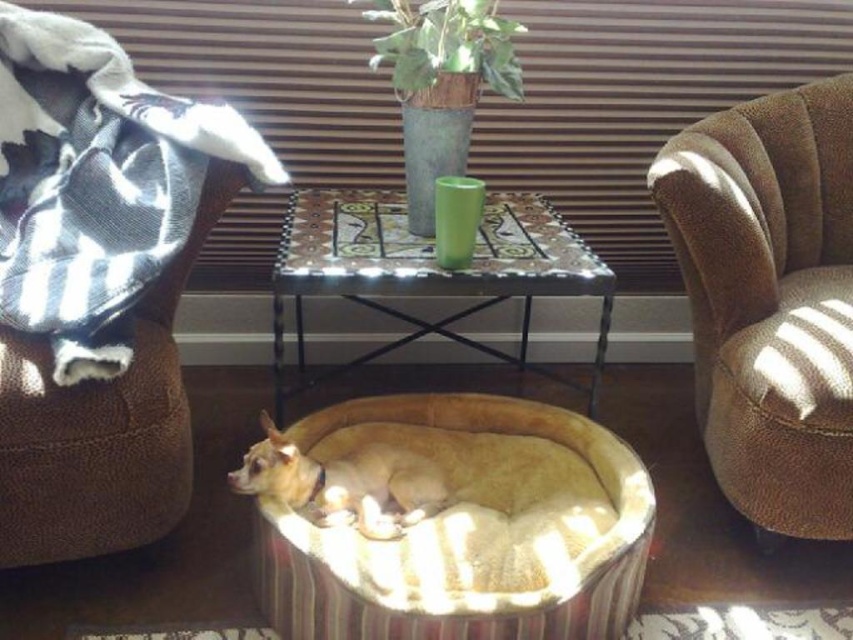
You are a dog owner who wants to ensure your Chihuahua has enough space to move comfortably in the velvet beige dog bed at center. The dog is currently looking towards the black and white striped fabric at upper left. Can you tell me if the dog bed is placed under the striped fabric?

The velvet beige dog bed at center is positioned under the black and white striped fabric at upper left, so yes, the dog bed is placed under the striped fabric.

You are a small cat trying to jump onto the brown textured armchair at right. The fuzzy beige dog at center is in your way. Can you go around the dog to reach the chair?

The brown textured armchair at right is taller than the fuzzy beige dog at center, so you can jump over the dog to reach the chair.

You are standing in the room and want to place a new decorative item on the floor. The velvet beige dog bed at center is already occupying a spot marked by point (451, 522). If you want to place the new item 0.3 units to the left of the dog bed, what coordinate would that be?

The new coordinate would be 0.817 minus 0.3 equals 0.517, so the coordinate is 0.517, 0.530.